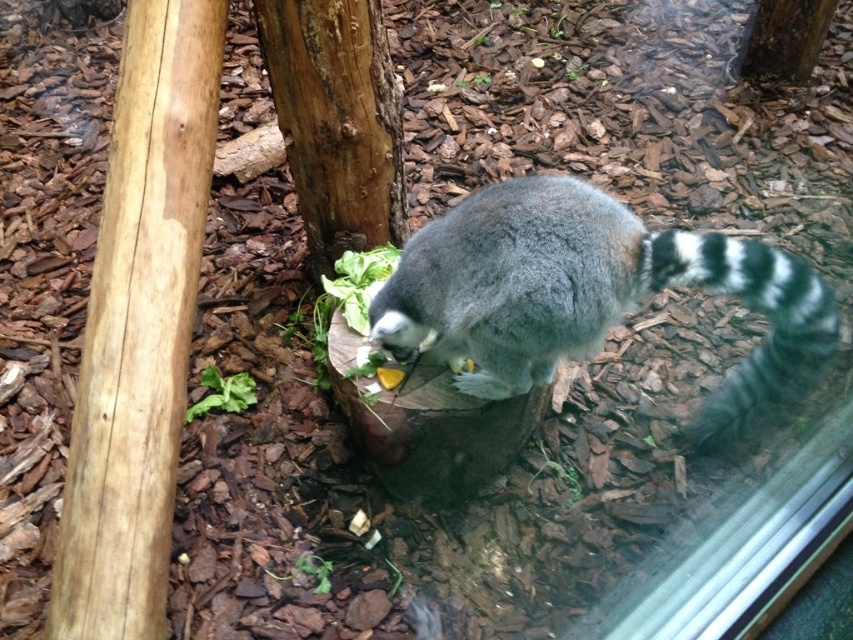
Question: Among these points, which one is farthest from the camera?

Choices:
 (A) (325, 19)
 (B) (722, 412)
 (C) (802, 49)

Answer: (C)

Question: Which point appears closest to the camera in this image?

Choices:
 (A) (776, 364)
 (B) (746, 76)

Answer: (A)

Question: Is the position of black and white striped tail at lower right more distant than that of brown rough bark at upper center?

Choices:
 (A) yes
 (B) no

Answer: (B)

Question: Does brown rough bark at center come behind brown rough bark at upper center?

Choices:
 (A) yes
 (B) no

Answer: (B)

Question: Based on their relative distances, which object is farther from the gray fur lemur at center?

Choices:
 (A) black and white striped tail at lower right
 (B) brown rough bark at upper center
 (C) brown rough bark at center

Answer: (B)

Question: Does brown rough bark at center lie in front of brown rough bark at upper center?

Choices:
 (A) no
 (B) yes

Answer: (B)